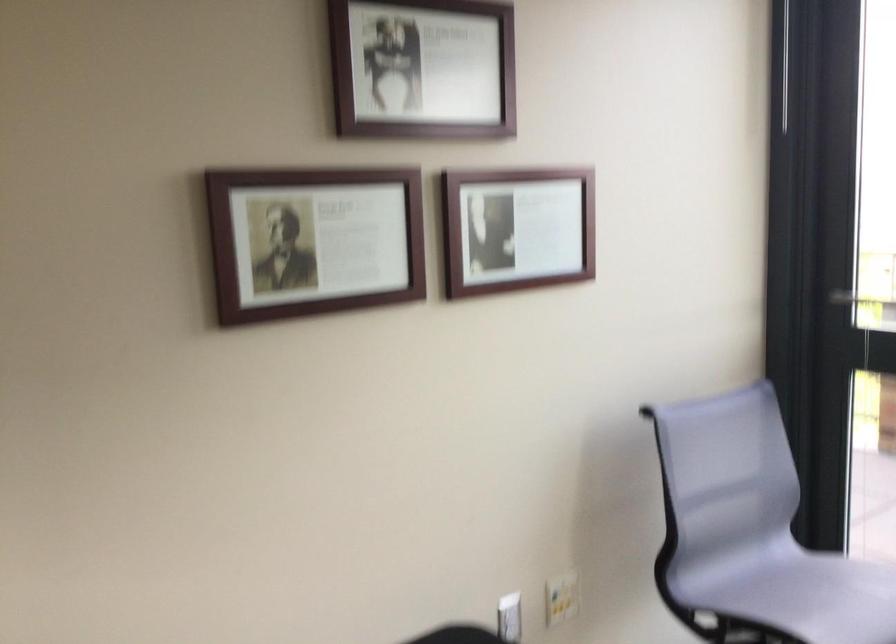
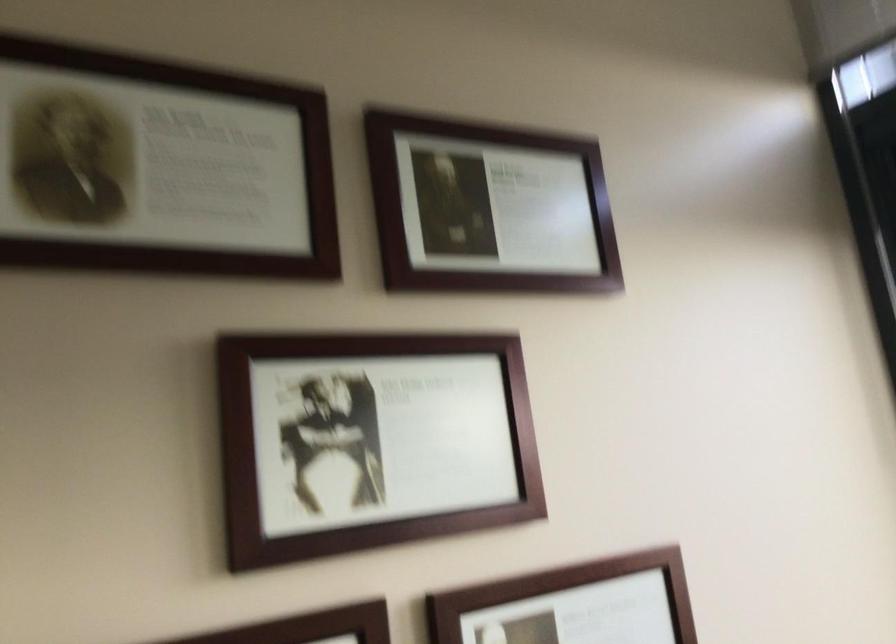
In the second image, find the point that corresponds to [524,189] in the first image.

(573, 605)